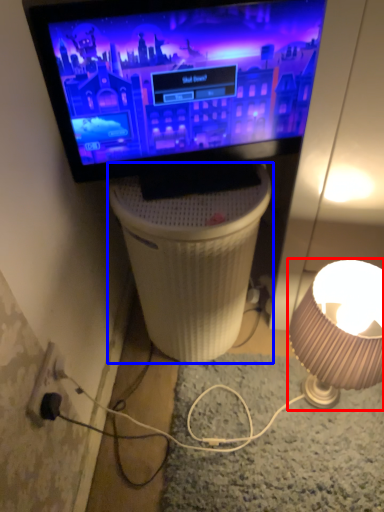
Question: Which object appears closest to the camera in this image, lamp (highlighted by a red box) or table (highlighted by a blue box)?

Choices:
 (A) lamp
 (B) table

Answer: (A)